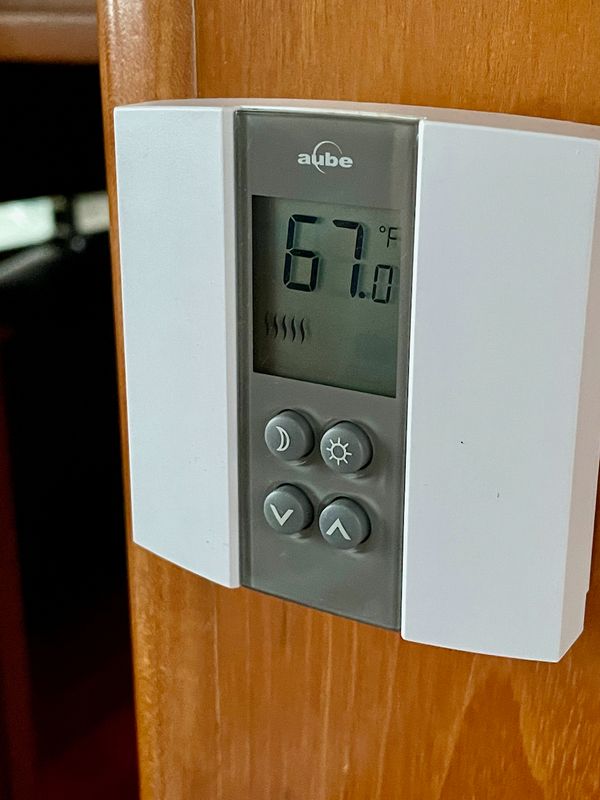
Identify the location of white thermostat casing. (513, 524).